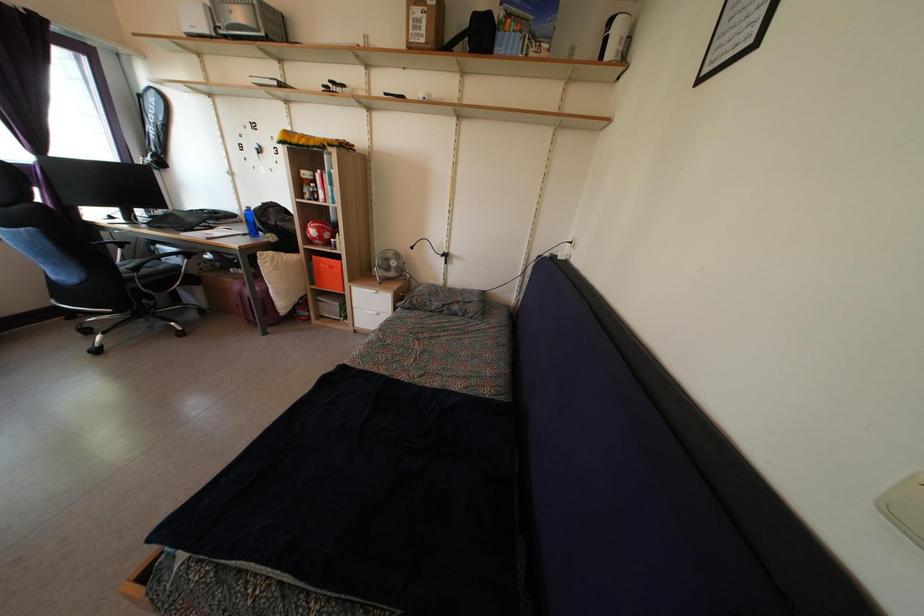
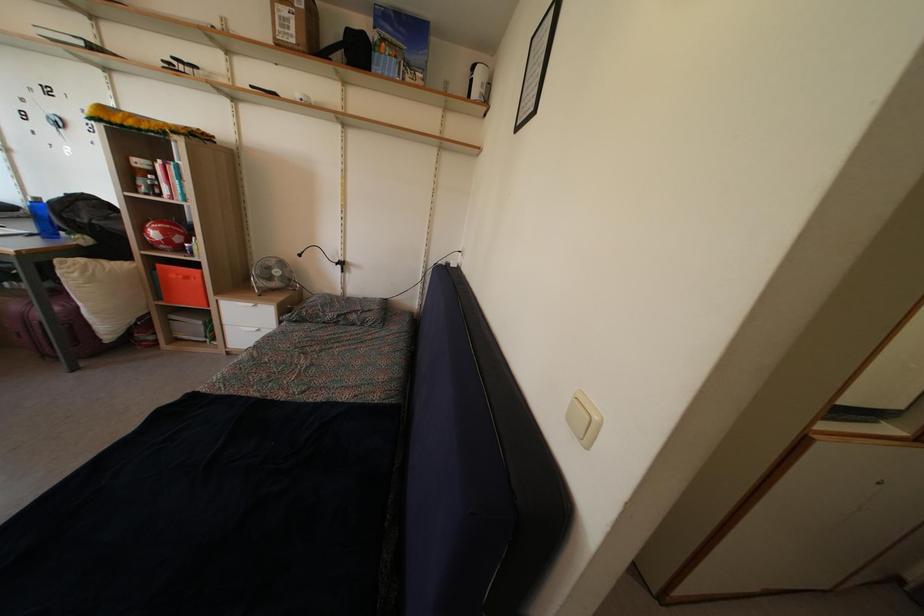
Locate, in the second image, the point that corresponds to the point at 289,142 in the first image.

(106, 116)